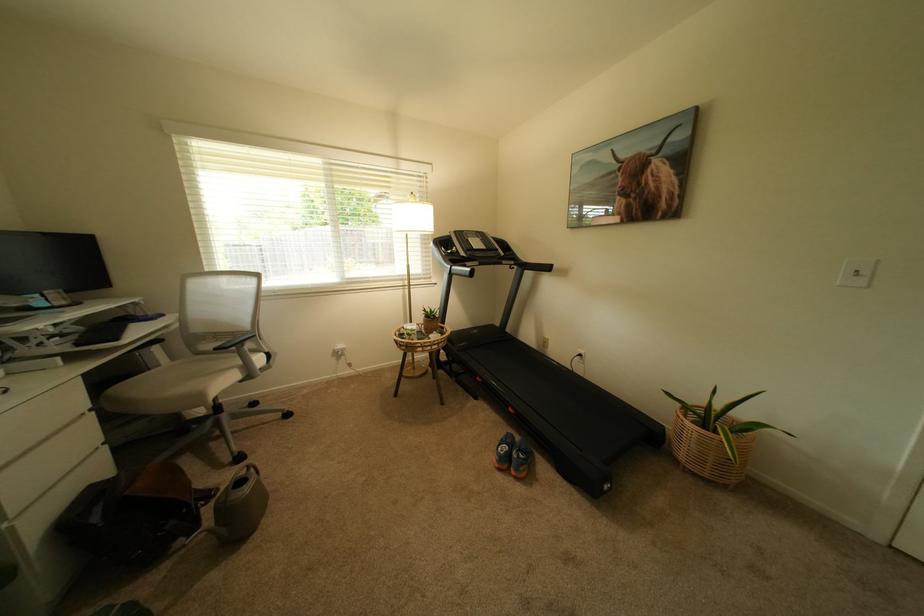
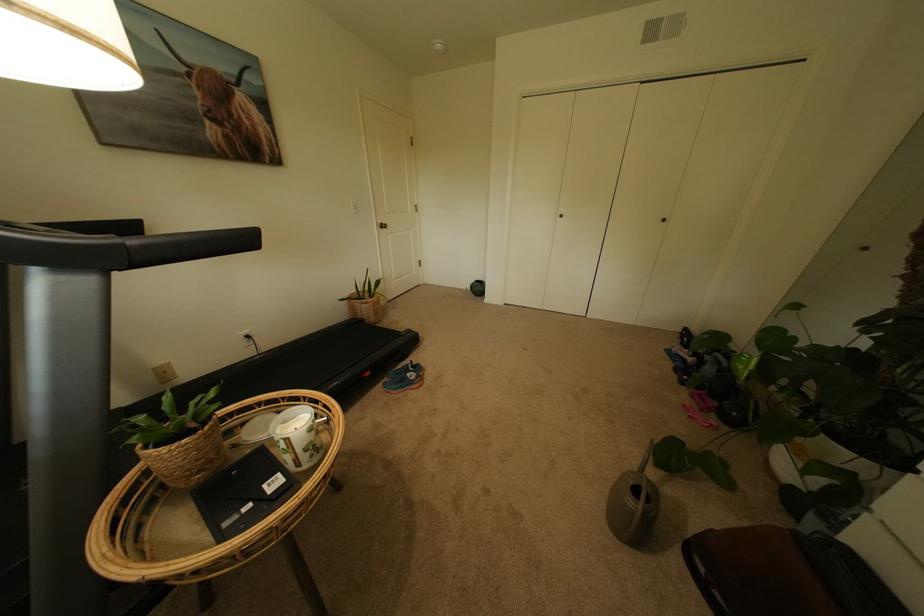
Where in the second image is the point corresponding to point 695,448 from the first image?

(382, 314)